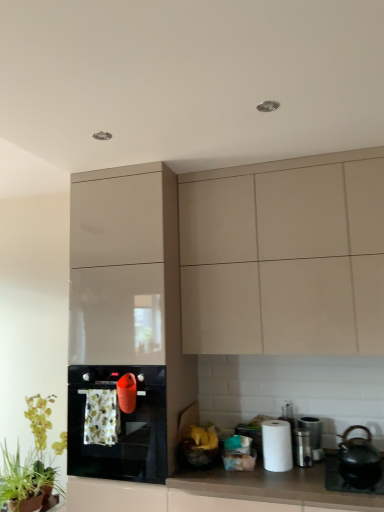
What do you see at coordinates (20, 482) in the screenshot? I see `green leafy plant at lower left, which is the 2th plant in back-to-front order` at bounding box center [20, 482].

What do you see at coordinates (284, 256) in the screenshot?
I see `matte beige cabinet at upper center, which is counted as the 1th cabinetry, starting from the right` at bounding box center [284, 256].

Describe the element at coordinates (355, 464) in the screenshot. I see `black ceramic sink at lower right` at that location.

How much space does green leafy plant at lower left, which is the 2th plant in front-to-back order, occupy horizontally?

19.33 centimeters.

The height and width of the screenshot is (512, 384). What do you see at coordinates (302, 447) in the screenshot? I see `metallic silver trash can at lower right, marked as the 1th appliance in a front-to-back arrangement` at bounding box center [302, 447].

What is the approximate width of metallic silver trash can at lower right, marked as the 1th appliance in a front-to-back arrangement?

It is 12.89 centimeters.

How much space does glossy beige cabinet at center, which is the first cabinetry in left-to-right order, occupy horizontally?

It is 58.45 centimeters.

In order to click on green leafy plant at lower left, marked as the first plant in a front-to-back arrangement in this screenshot , I will do `click(20, 482)`.

Can you confirm if green leafy plant at lower left, which is the first plant from back to front, is bigger than satin silver canister at lower right, arranged as the second appliance when viewed from the front?

Yes, green leafy plant at lower left, which is the first plant from back to front, is bigger than satin silver canister at lower right, arranged as the second appliance when viewed from the front.

Is point (29, 397) farther from camera compared to point (312, 418)?

That is True.

From a real-world perspective, does green leafy plant at lower left, which is the 2th plant in front-to-back order, sit lower than satin silver canister at lower right, arranged as the second appliance when viewed from the front?

Yes.

Can you confirm if green leafy plant at lower left, which is the 2th plant in front-to-back order, is positioned to the left of satin silver canister at lower right, marked as the first appliance in a back-to-front arrangement?

Yes.

Is the surface of black ceramic sink at lower right in direct contact with green leafy plant at lower left, which is the first plant from back to front?

No, black ceramic sink at lower right is not next to green leafy plant at lower left, which is the first plant from back to front.

From the picture: From the image's perspective, would you say black ceramic sink at lower right is shown under green leafy plant at lower left, which is the first plant from back to front?

No.

Considering the relative positions of black ceramic sink at lower right and green leafy plant at lower left, which is the first plant from back to front, in the image provided, is black ceramic sink at lower right to the left or to the right of green leafy plant at lower left, which is the first plant from back to front,?

black ceramic sink at lower right is to the right of green leafy plant at lower left, which is the first plant from back to front.

Considering the relative sizes of black ceramic sink at lower right and green leafy plant at lower left, which is the first plant from back to front, in the image provided, is black ceramic sink at lower right smaller than green leafy plant at lower left, which is the first plant from back to front,?

Correct, black ceramic sink at lower right occupies less space than green leafy plant at lower left, which is the first plant from back to front.

Where is `cabinetry that is the 1st one above the green leafy plant at lower left, which is the 2th plant in front-to-back order (from a real-world perspective)`? This screenshot has height=512, width=384. cabinetry that is the 1st one above the green leafy plant at lower left, which is the 2th plant in front-to-back order (from a real-world perspective) is located at coordinates (125, 324).

Based on the photo, who is shorter, green leafy plant at lower left, which is the 2th plant in front-to-back order, or glossy beige cabinet at center, which is the first cabinetry in left-to-right order?

green leafy plant at lower left, which is the 2th plant in front-to-back order, is shorter.

Based on the photo, are green leafy plant at lower left, which is the 2th plant in front-to-back order, and glossy beige cabinet at center, marked as the 2th cabinetry in a right-to-left arrangement, far apart?

No.

Considering the positions of point (173, 494) and point (280, 464), is point (173, 494) closer or farther from the camera than point (280, 464)?

Point (173, 494).

How many degrees apart are the facing directions of white matte countertop at lower center and white paper at right?

0.689 degrees.

Considering the sizes of objects white matte countertop at lower center and white paper at right in the image provided, who is shorter, white matte countertop at lower center or white paper at right?

white paper at right is shorter.

Consider the image. Is white matte countertop at lower center not inside white paper at right?

Yes, white matte countertop at lower center is outside of white paper at right.

From a real-world perspective, is metallic silver trash can at lower right, marked as the 1th appliance in a front-to-back arrangement, over white matte countertop at lower center?

Yes, from a real-world perspective, metallic silver trash can at lower right, marked as the 1th appliance in a front-to-back arrangement, is on top of white matte countertop at lower center.

Considering the sizes of metallic silver trash can at lower right, marked as the 2th appliance in a back-to-front arrangement, and white matte countertop at lower center in the image, is metallic silver trash can at lower right, marked as the 2th appliance in a back-to-front arrangement, taller or shorter than white matte countertop at lower center?

metallic silver trash can at lower right, marked as the 2th appliance in a back-to-front arrangement, is shorter than white matte countertop at lower center.

Looking at this image, considering the relative positions of metallic silver trash can at lower right, marked as the 1th appliance in a front-to-back arrangement, and white matte countertop at lower center in the image provided, is metallic silver trash can at lower right, marked as the 1th appliance in a front-to-back arrangement, to the left of white matte countertop at lower center from the viewer's perspective?

No.

Between matte beige cabinet at upper center, which is counted as the 1th cabinetry, starting from the right, and metallic silver trash can at lower right, marked as the 2th appliance in a back-to-front arrangement, which one has smaller size?

metallic silver trash can at lower right, marked as the 2th appliance in a back-to-front arrangement, is smaller.

Would you say matte beige cabinet at upper center, which is counted as the 1th cabinetry, starting from the right, is a long distance from metallic silver trash can at lower right, marked as the 2th appliance in a back-to-front arrangement?

They are positioned close to each other.

From the image's perspective, starting from the matte beige cabinet at upper center, which is counted as the 1th cabinetry, starting from the right, which appliance is the 1st one below? Please provide its 2D coordinates.

[(302, 447)]

From the image's perspective, would you say matte beige cabinet at upper center, which is counted as the 1th cabinetry, starting from the right, is shown under metallic silver trash can at lower right, marked as the 2th appliance in a back-to-front arrangement?

No.

Is green leafy plant at lower left, which is the 2th plant in front-to-back order, beside matte beige cabinet at upper center, which appears as the second cabinetry when viewed from the left?

No, green leafy plant at lower left, which is the 2th plant in front-to-back order, is not making contact with matte beige cabinet at upper center, which appears as the second cabinetry when viewed from the left.

Does green leafy plant at lower left, which is the 2th plant in front-to-back order, have a greater height compared to matte beige cabinet at upper center, which appears as the second cabinetry when viewed from the left?

In fact, green leafy plant at lower left, which is the 2th plant in front-to-back order, may be shorter than matte beige cabinet at upper center, which appears as the second cabinetry when viewed from the left.

Is the depth of green leafy plant at lower left, which is the 2th plant in front-to-back order, greater than that of matte beige cabinet at upper center, which is counted as the 1th cabinetry, starting from the right?

Yes, it is behind matte beige cabinet at upper center, which is counted as the 1th cabinetry, starting from the right.

Identify the location of appliance that is the 1st object located above the green leafy plant at lower left, which is the 2th plant in front-to-back order (from the image's perspective). (313, 435).

Locate an element on the screen. This screenshot has height=512, width=384. sink on the right of green leafy plant at lower left, which is the 2th plant in front-to-back order is located at coordinates (355, 464).

When comparing their distances from metallic silver trash can at lower right, marked as the 1th appliance in a front-to-back arrangement, does black ceramic sink at lower right or black glossy oven at lower left seem closer?

black ceramic sink at lower right is closer to metallic silver trash can at lower right, marked as the 1th appliance in a front-to-back arrangement.

Estimate the real-world distances between objects in this image. Which object is closer to white matte countertop at lower center, black glossy oven at lower left or metallic silver trash can at lower right, marked as the 2th appliance in a back-to-front arrangement?

metallic silver trash can at lower right, marked as the 2th appliance in a back-to-front arrangement, is positioned closer to the anchor white matte countertop at lower center.

Based on their spatial positions, is matte beige cabinet at upper center, which is counted as the 1th cabinetry, starting from the right, or black ceramic sink at lower right further from green leafy plant at lower left, marked as the first plant in a front-to-back arrangement?

Based on the image, matte beige cabinet at upper center, which is counted as the 1th cabinetry, starting from the right, appears to be further to green leafy plant at lower left, marked as the first plant in a front-to-back arrangement.

Based on their spatial positions, is white paper at right or black glossy oven at lower left further from metallic silver trash can at lower right, marked as the 2th appliance in a back-to-front arrangement?

The object further to metallic silver trash can at lower right, marked as the 2th appliance in a back-to-front arrangement, is black glossy oven at lower left.

When comparing their distances from black ceramic sink at lower right, does satin silver canister at lower right, arranged as the second appliance when viewed from the front, or white matte countertop at lower center seem closer?

satin silver canister at lower right, arranged as the second appliance when viewed from the front, lies closer to black ceramic sink at lower right than the other object.

When comparing their distances from white matte countertop at lower center, does green leafy plant at lower left, which is the 2th plant in back-to-front order, or black glossy oven at lower left seem closer?

black glossy oven at lower left is closer to white matte countertop at lower center.

Considering their positions, is white paper at right positioned closer to black glossy oven at lower left than glossy beige cabinet at center, marked as the 2th cabinetry in a right-to-left arrangement?

glossy beige cabinet at center, marked as the 2th cabinetry in a right-to-left arrangement, lies closer to black glossy oven at lower left than the other object.

Looking at the image, which one is located further to black ceramic sink at lower right, black glossy oven at lower left or green leafy plant at lower left, marked as the first plant in a front-to-back arrangement?

Among the two, green leafy plant at lower left, marked as the first plant in a front-to-back arrangement, is located further to black ceramic sink at lower right.

Locate an element on the screen. Image resolution: width=384 pixels, height=512 pixels. paper towel situated between green leafy plant at lower left, marked as the first plant in a front-to-back arrangement, and black ceramic sink at lower right from left to right is located at coordinates (277, 445).

You are a GUI agent. You are given a task and a screenshot of the screen. Output one action in this format:
    pyautogui.click(x=<x>, y=<y>)
    Task: Click on the kitchen appliance located between green leafy plant at lower left, marked as the first plant in a front-to-back arrangement, and matte beige cabinet at upper center, which appears as the second cabinetry when viewed from the left, in the left-right direction
    
    Given the screenshot: What is the action you would take?
    pyautogui.click(x=117, y=424)

The image size is (384, 512). I want to click on paper towel that lies between matte beige cabinet at upper center, which is counted as the 1th cabinetry, starting from the right, and white matte countertop at lower center from top to bottom, so [x=277, y=445].

Locate an element on the screen. The width and height of the screenshot is (384, 512). paper towel situated between glossy beige cabinet at center, which is the first cabinetry in left-to-right order, and white matte countertop at lower center from left to right is located at coordinates (277, 445).